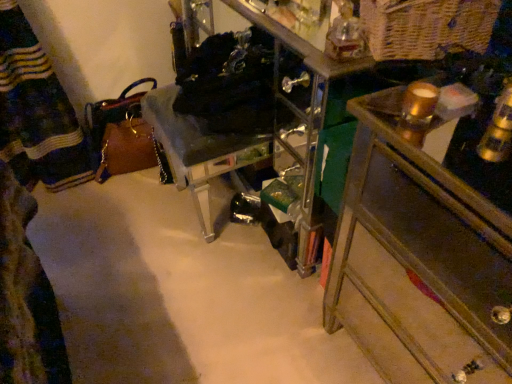
Question: Choose the correct answer: Is black fabric laundry at center inside clear acrylic chair at center or outside it?

Choices:
 (A) inside
 (B) outside

Answer: (B)

Question: Is point (253, 104) closer or farther from the camera than point (158, 130)?

Choices:
 (A) farther
 (B) closer

Answer: (B)

Question: Estimate the real-world distances between objects in this image. Which object is farther from the clear acrylic chair at center?

Choices:
 (A) wooden chest of drawers at right
 (B) woven natural basket at upper right
 (C) black fabric laundry at center
 (D) gold metallic candle at upper right

Answer: (D)

Question: Which is nearer to the wooden chest of drawers at right?

Choices:
 (A) clear acrylic chair at center
 (B) woven natural basket at upper right
 (C) black fabric laundry at center
 (D) gold metallic candle at upper right

Answer: (D)